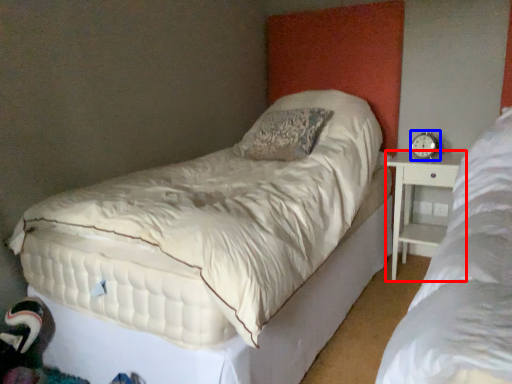
Question: Which of the following is the closest to the observer, nightstand (highlighted by a red box) or alarm clock (highlighted by a blue box)?

Choices:
 (A) nightstand
 (B) alarm clock

Answer: (A)